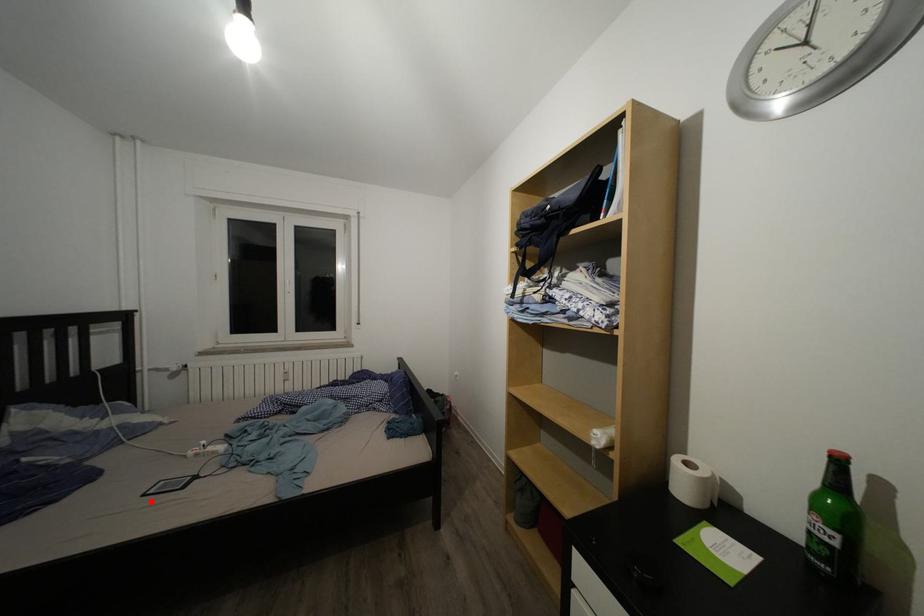
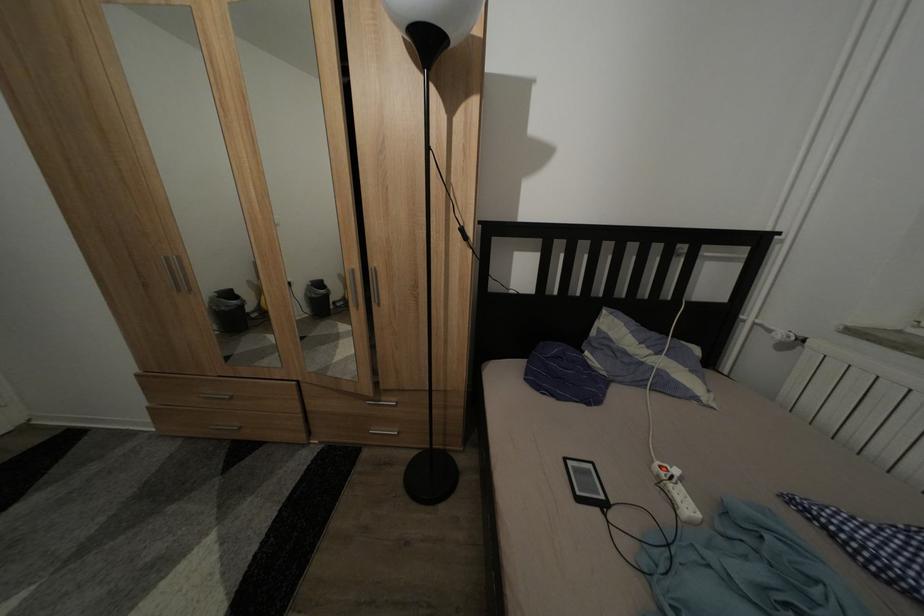
Locate, in the second image, the point that corresponds to the highlighted location in the first image.

(573, 466)